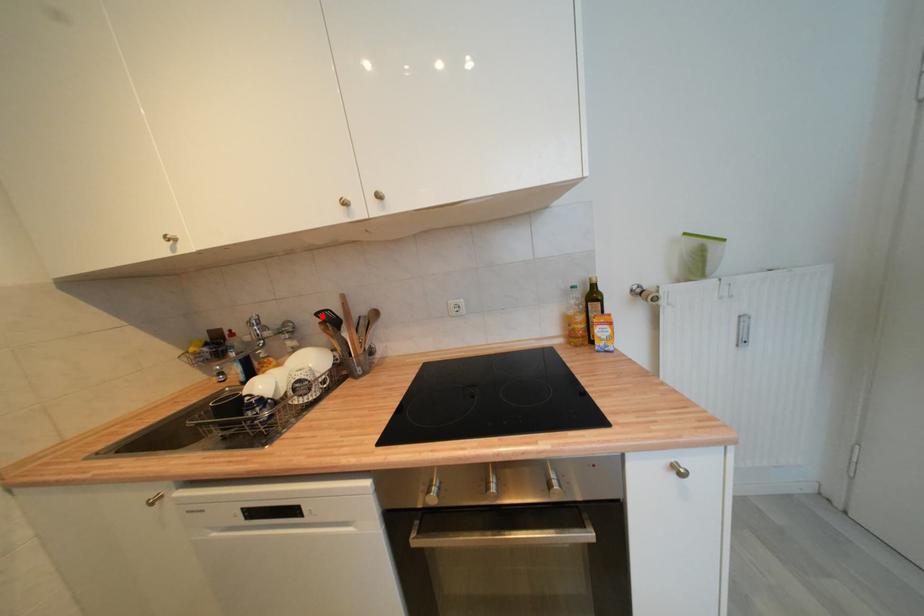
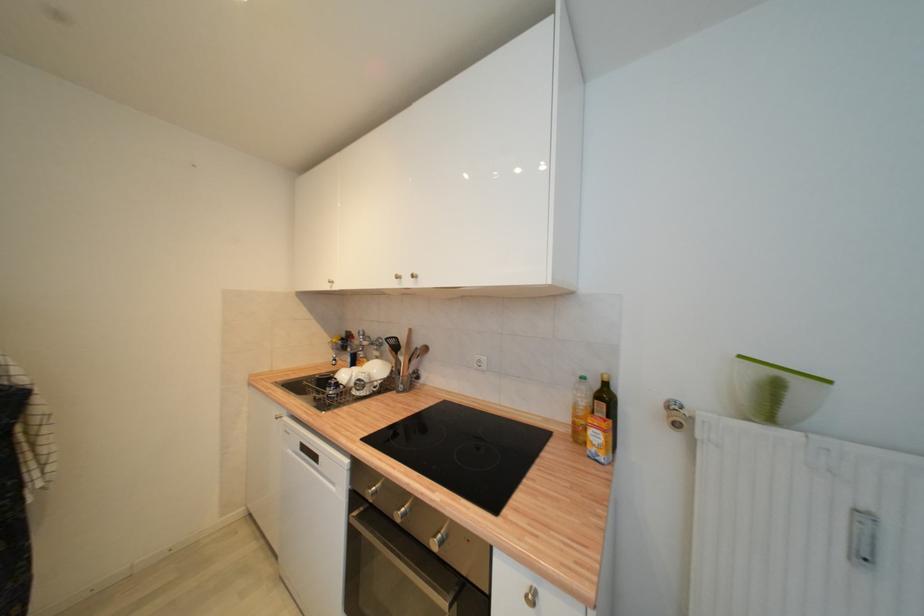
In the second image, find the point that corresponds to the highlighted location in the first image.

(392, 341)